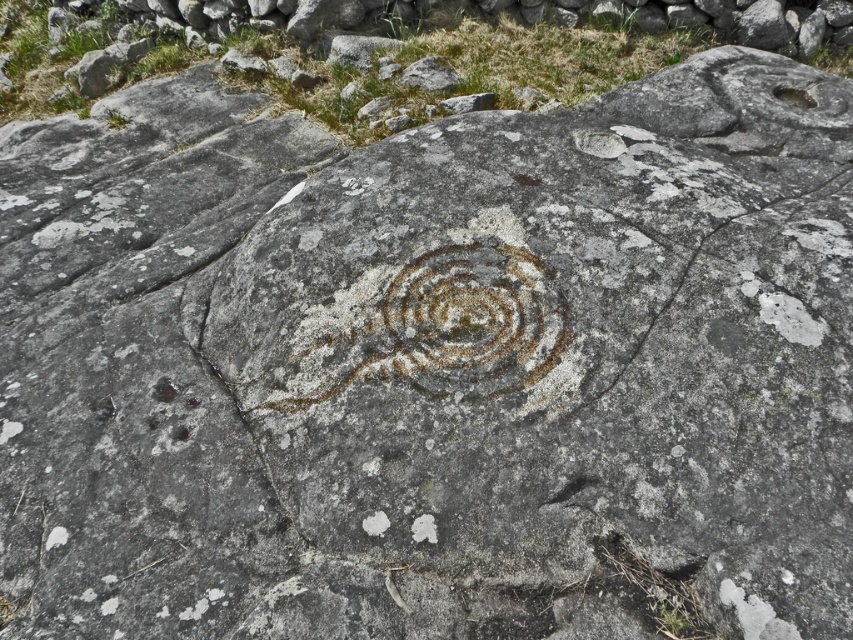
Question: Can you confirm if gray rough crack at center is bigger than rusty stone swirl at center?

Choices:
 (A) yes
 (B) no

Answer: (A)

Question: Which point is closer to the camera?

Choices:
 (A) (703, 246)
 (B) (407, 262)

Answer: (A)

Question: Observing the image, what is the correct spatial positioning of gray rough crack at center in reference to rusty stone swirl at center?

Choices:
 (A) above
 (B) below

Answer: (A)

Question: Does gray rough crack at center have a larger size compared to rusty stone swirl at center?

Choices:
 (A) yes
 (B) no

Answer: (A)